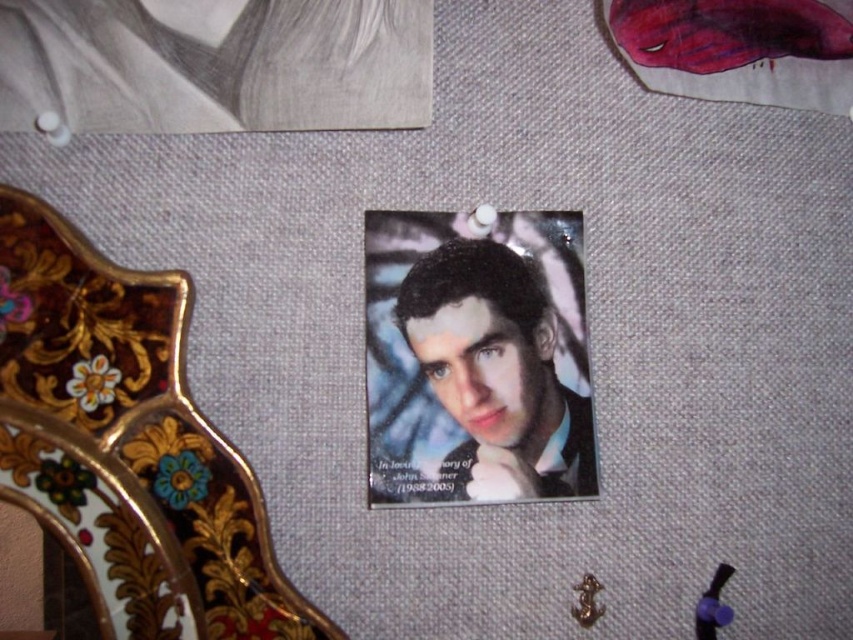
Question: Which point appears closest to the camera in this image?

Choices:
 (A) (140, 460)
 (B) (445, 296)

Answer: (A)

Question: Does gold painted wood at center come behind matte black portrait at center?

Choices:
 (A) no
 (B) yes

Answer: (A)

Question: Is gold painted wood at center to the right of matte black portrait at center from the viewer's perspective?

Choices:
 (A) yes
 (B) no

Answer: (B)

Question: Which object is farther from the camera taking this photo?

Choices:
 (A) gold painted wood at center
 (B) matte black portrait at center

Answer: (B)

Question: Is gold painted wood at center positioned before matte black portrait at center?

Choices:
 (A) no
 (B) yes

Answer: (B)